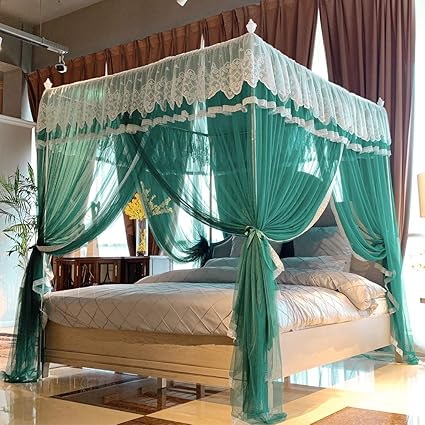
The height and width of the screenshot is (425, 425). I want to click on lights, so click(x=34, y=38).